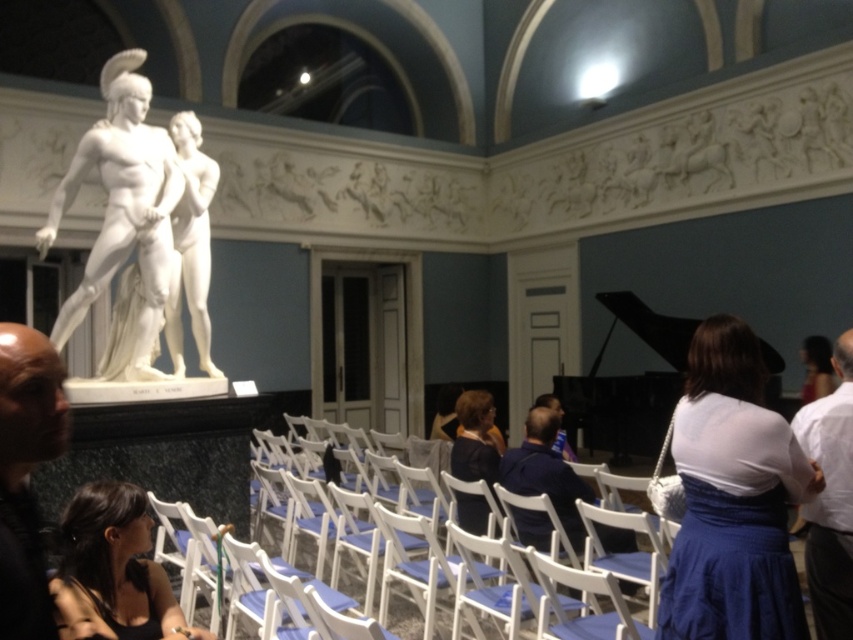
You are an art curator examining the statue of the two figures. Which object is positioned to the left of the other between the bald head at left and the white cotton shirt at right?

The bald head at left is positioned to the left of the white cotton shirt at right.

You are a photographer setting up a shoot in the described elegant interior. You have two items to photograph next to each other on a table near the white marble statue. The table is only wide enough to accommodate the wider of the two items. Which item should you choose between the white fabric dress at right and the white cotton shirt at right?

The white fabric dress at right might be wider than the white cotton shirt at right, so you should choose the white fabric dress at right to ensure it fits on the table.